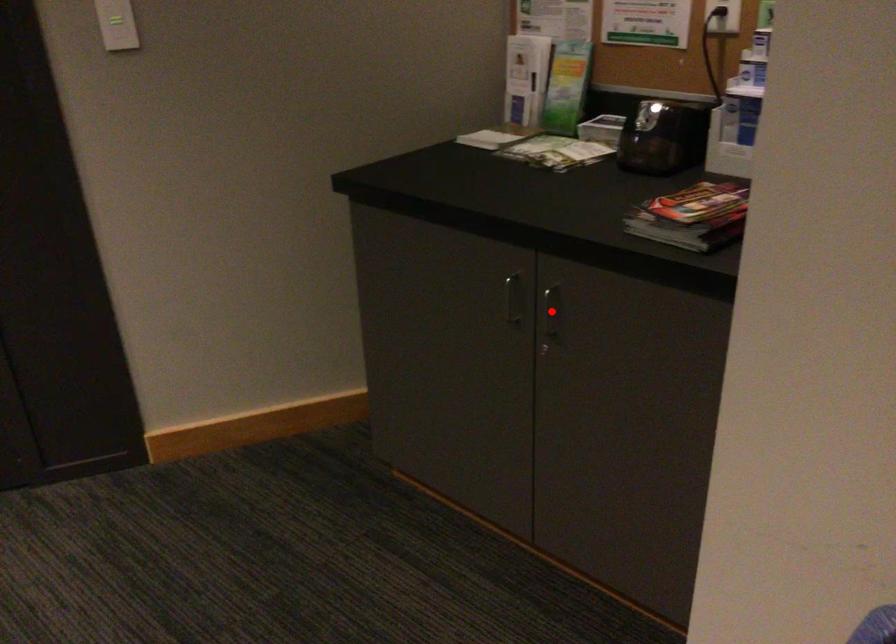
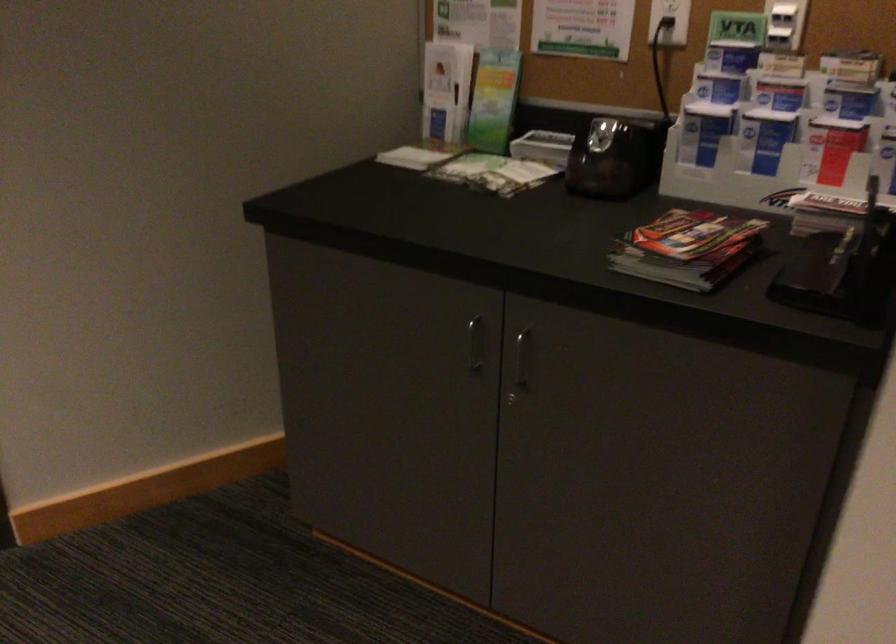
Question: I am providing you with two images of the same scene from different viewpoints. A red point is shown in image1. For the corresponding object point in image2, is it positioned nearer or farther from the camera?

Choices:
 (A) Nearer
 (B) Farther

Answer: (A)